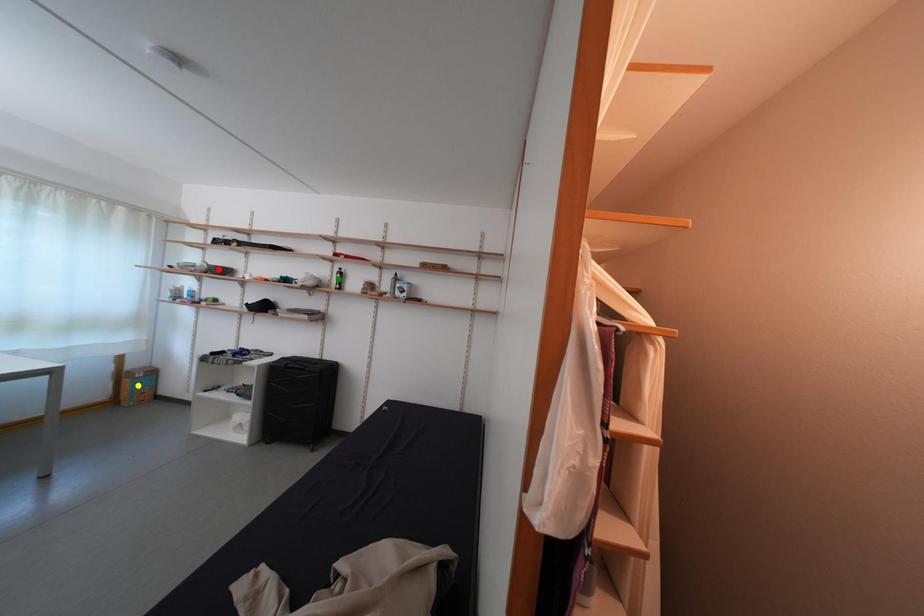
Order these from nearest to farthest:
1. green point
2. red point
3. yellow point

green point, yellow point, red point